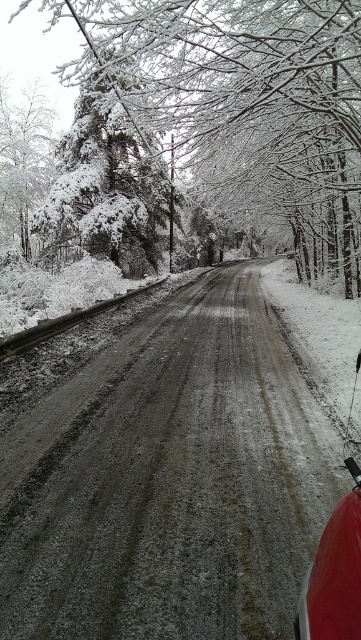
Does white snow-covered tree at left have a greater width compared to snow-covered tree at left?

Incorrect, white snow-covered tree at left's width does not surpass snow-covered tree at left's.

Find the location of a particular element. white snow-covered tree at left is located at coordinates (106, 186).

Is dull gray gravel road at center taller than snow-covered evergreen at left?

No, dull gray gravel road at center is not taller than snow-covered evergreen at left.

You are a GUI agent. You are given a task and a screenshot of the screen. Output one action in this format:
    pyautogui.click(x=<x>, y=<y>)
    Task: Click on the dull gray gravel road at center
    The width and height of the screenshot is (361, 640).
    Given the screenshot: What is the action you would take?
    pyautogui.click(x=168, y=481)

The width and height of the screenshot is (361, 640). What are the coordinates of `dull gray gravel road at center` in the screenshot? It's located at point(168,481).

The height and width of the screenshot is (640, 361). What are the coordinates of `dull gray gravel road at center` in the screenshot? It's located at (168, 481).

Can you confirm if snow-covered evergreen at left is wider than snow-covered tree at left?

Yes.

Is snow-covered evergreen at left below snow-covered tree at left?

No, snow-covered evergreen at left is not below snow-covered tree at left.

Who is more forward, (202, 22) or (19, 128)?

Point (202, 22) is in front.

You are a GUI agent. You are given a task and a screenshot of the screen. Output one action in this format:
    pyautogui.click(x=<x>, y=<y>)
    Task: Click on the snow-covered evergreen at left
    Image resolution: width=361 pixels, height=640 pixels.
    Given the screenshot: What is the action you would take?
    pyautogui.click(x=245, y=99)